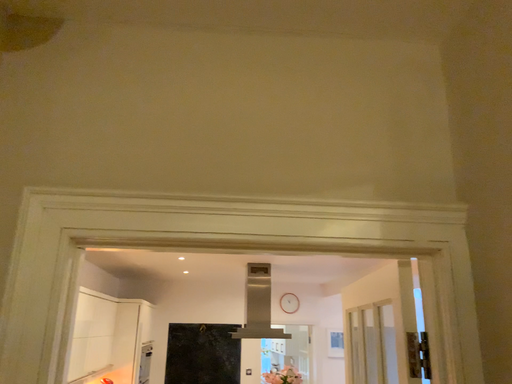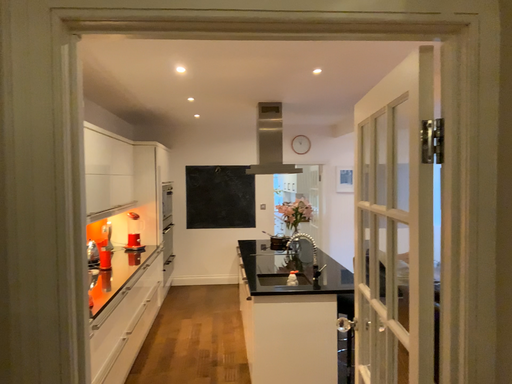
Question: Which way did the camera rotate in the video?

Choices:
 (A) rotated downward
 (B) rotated upward

Answer: (A)